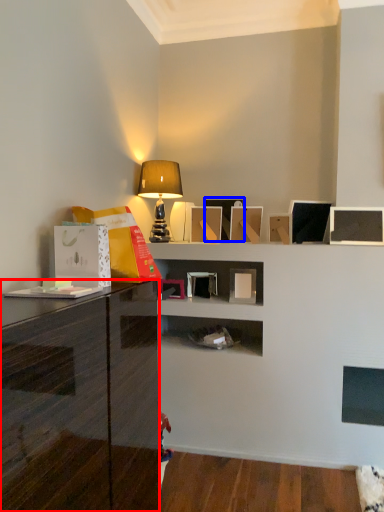
Question: Which object is further to the camera taking this photo, cabinetry (highlighted by a red box) or picture frame (highlighted by a blue box)?

Choices:
 (A) cabinetry
 (B) picture frame

Answer: (B)